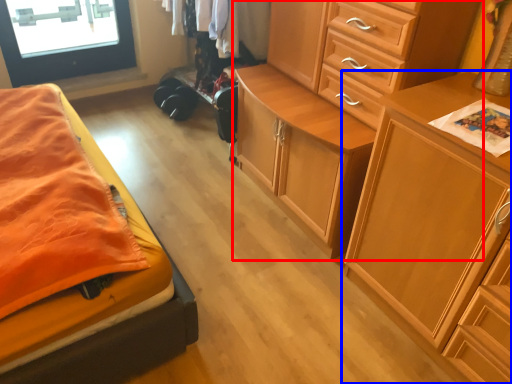
Question: Which of the following is the closest to the observer, chest of drawers (highlighted by a red box) or chest of drawers (highlighted by a blue box)?

Choices:
 (A) chest of drawers
 (B) chest of drawers

Answer: (B)